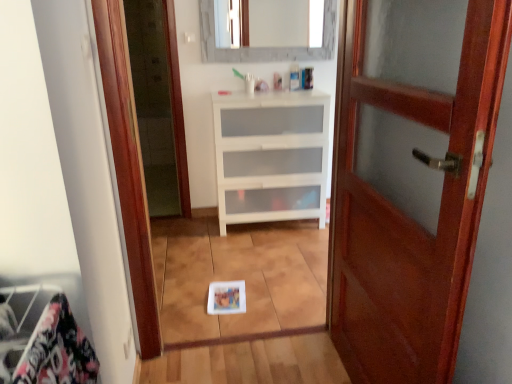
The height and width of the screenshot is (384, 512). Identify the location of matte gray mirror at upper center. 285,23.

This screenshot has height=384, width=512. What do you see at coordinates (285, 23) in the screenshot?
I see `matte gray mirror at upper center` at bounding box center [285, 23].

Describe the element at coordinates (271, 156) in the screenshot. I see `white matte chest of drawers at center` at that location.

The image size is (512, 384). Identify the location of mahogany wood door at right. (408, 216).

In order to face mahogany wood door at right, should I rotate leftwards or rightwards?

Turn right by 15.916 degrees to look at mahogany wood door at right.

This screenshot has height=384, width=512. I want to click on matte gray mirror at upper center, so click(285, 23).

Is mahogany wood door at right aimed at matte gray mirror at upper center?

No, mahogany wood door at right does not turn towards matte gray mirror at upper center.

Is mahogany wood door at right not close to matte gray mirror at upper center?

That's right, there is a large distance between mahogany wood door at right and matte gray mirror at upper center.

Does mahogany wood door at right have a greater width compared to matte gray mirror at upper center?

Indeed, mahogany wood door at right has a greater width compared to matte gray mirror at upper center.

In the scene shown: From a real-world perspective, is mahogany wood door at right over matte gray mirror at upper center?

Actually, mahogany wood door at right is physically below matte gray mirror at upper center in the real world.

From the image's perspective, relative to mahogany wood door at right, is matte gray mirror at upper center above or below?

matte gray mirror at upper center is situated higher than mahogany wood door at right in the image.

Is matte gray mirror at upper center facing towards mahogany wood door at right?

Yes, matte gray mirror at upper center is oriented towards mahogany wood door at right.

Between matte gray mirror at upper center and mahogany wood door at right, which one has larger width?

mahogany wood door at right.

Can you tell me how much matte gray mirror at upper center and mahogany wood door at right differ in facing direction?

The facing directions of matte gray mirror at upper center and mahogany wood door at right are 90.8 degrees apart.

Based on their sizes in the image, would you say white matte chest of drawers at center is bigger or smaller than matte gray mirror at upper center?

Clearly, white matte chest of drawers at center is larger in size than matte gray mirror at upper center.

How much distance is there between white matte chest of drawers at center and matte gray mirror at upper center?

A distance of 6.33 feet exists between white matte chest of drawers at center and matte gray mirror at upper center.

Is white matte chest of drawers at center thinner than matte gray mirror at upper center?

Incorrect, the width of white matte chest of drawers at center is not less than that of matte gray mirror at upper center.

Considering the sizes of objects white matte chest of drawers at center and mahogany wood door at right in the image provided, who is taller, white matte chest of drawers at center or mahogany wood door at right?

mahogany wood door at right.

Considering the positions of point (218, 189) and point (488, 106), is point (218, 189) closer or farther from the camera than point (488, 106)?

Point (218, 189) appears to be farther away from the viewer than point (488, 106).

Is white matte chest of drawers at center turned away from mahogany wood door at right?

No, white matte chest of drawers at center's orientation is not away from mahogany wood door at right.

From a real-world perspective, who is located lower, white matte chest of drawers at center or mahogany wood door at right?

In real-world perspective, white matte chest of drawers at center is lower.

Who is more distant, matte gray mirror at upper center or white matte chest of drawers at center?

matte gray mirror at upper center is further away from the camera.

Is matte gray mirror at upper center positioned far away from white matte chest of drawers at center?

That's right, there is a large distance between matte gray mirror at upper center and white matte chest of drawers at center.

From a real-world perspective, which is physically above, matte gray mirror at upper center or white matte chest of drawers at center?

matte gray mirror at upper center is physically above.

Which object is wider, matte gray mirror at upper center or white matte chest of drawers at center?

With larger width is white matte chest of drawers at center.

Is mahogany wood door at right to the left or to the right of white matte chest of drawers at center in the image?

From the image, it's evident that mahogany wood door at right is to the right of white matte chest of drawers at center.

From the image's perspective, is mahogany wood door at right above or below white matte chest of drawers at center?

mahogany wood door at right is below white matte chest of drawers at center.

Considering the positions of point (403, 84) and point (256, 219), is point (403, 84) closer or farther from the camera than point (256, 219)?

Point (403, 84) is positioned closer to the camera compared to point (256, 219).

Is mahogany wood door at right oriented towards white matte chest of drawers at center?

No, mahogany wood door at right is not aimed at white matte chest of drawers at center.

At what (x,y) coordinates should I click in order to perform the action: click on door in front of the matte gray mirror at upper center. Please return your answer as a coordinate pair (x, y). This screenshot has width=512, height=384. Looking at the image, I should click on (408, 216).

In the image, there is a matte gray mirror at upper center. At what (x,y) coordinates should I click in order to perform the action: click on door below it (from a real-world perspective). Please return your answer as a coordinate pair (x, y). The height and width of the screenshot is (384, 512). Looking at the image, I should click on (408, 216).

Estimate the real-world distances between objects in this image. Which object is further from mahogany wood door at right, white matte chest of drawers at center or matte gray mirror at upper center?

matte gray mirror at upper center is positioned further to the anchor mahogany wood door at right.

Looking at the image, which one is located further to matte gray mirror at upper center, mahogany wood door at right or white matte chest of drawers at center?

Among the two, mahogany wood door at right is located further to matte gray mirror at upper center.

Estimate the real-world distances between objects in this image. Which object is further from white matte chest of drawers at center, matte gray mirror at upper center or mahogany wood door at right?

Based on the image, matte gray mirror at upper center appears to be further to white matte chest of drawers at center.

Considering their positions, is white matte chest of drawers at center positioned closer to matte gray mirror at upper center than mahogany wood door at right?

white matte chest of drawers at center lies closer to matte gray mirror at upper center than the other object.

From the image, which object appears to be nearer to white matte chest of drawers at center, mahogany wood door at right or matte gray mirror at upper center?

mahogany wood door at right is closer to white matte chest of drawers at center.

Looking at the image, which one is located closer to mahogany wood door at right, matte gray mirror at upper center or white matte chest of drawers at center?

white matte chest of drawers at center.

I want to click on chest of drawers between mahogany wood door at right and matte gray mirror at upper center along the z-axis, so click(x=271, y=156).